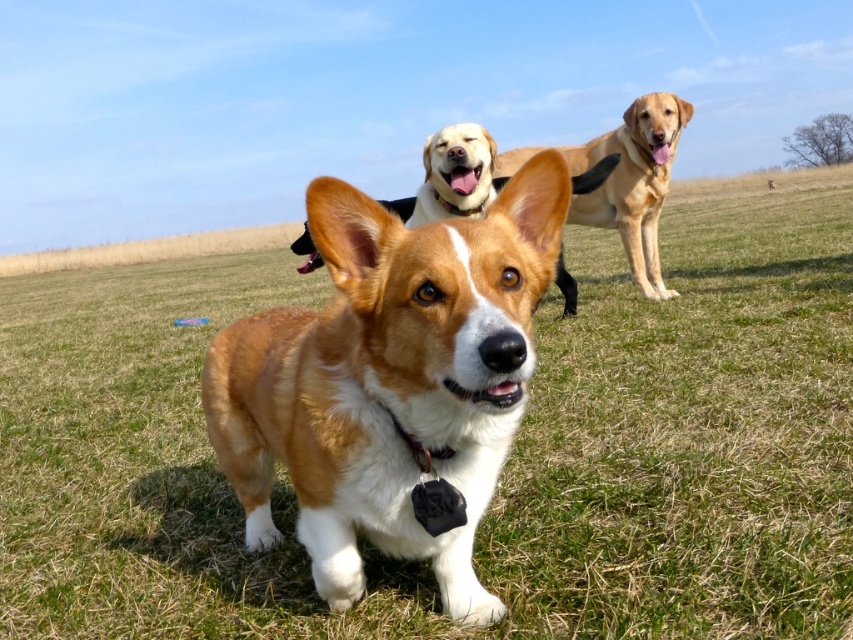
You are standing in the grassy field and see the brown and white fur at center. If your height is 6 feet, can you step over it without bending down?

The brown and white fur at center and viewer are 38.45 inches apart. Since the viewer is 6 feet tall, which is 72 inches, stepping over the fur at center would be possible without bending down as the distance is manageable.